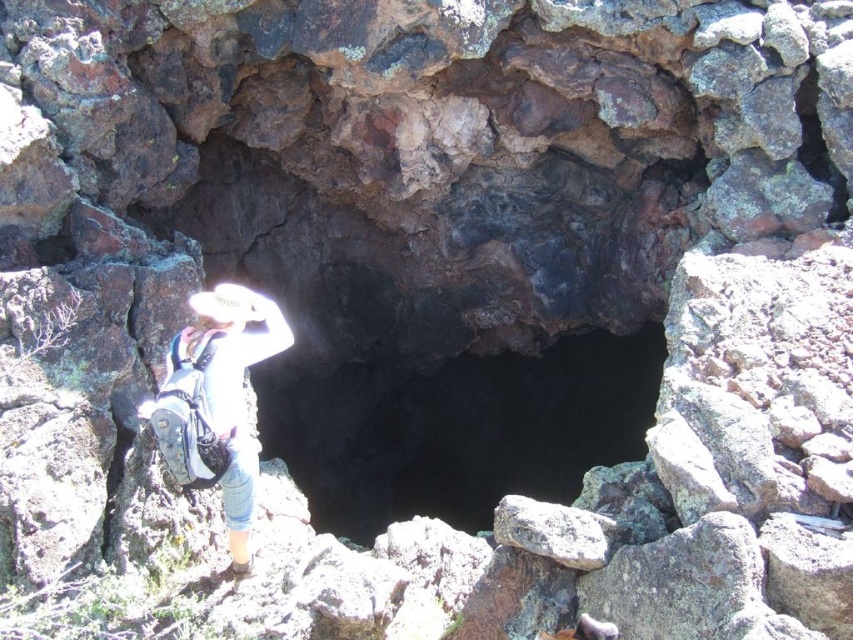
Question: Can you confirm if black rock hole at center is thinner than white fabric hat at upper center?

Choices:
 (A) no
 (B) yes

Answer: (A)

Question: Is black rock hole at center below white fabric hat at upper center?

Choices:
 (A) no
 (B) yes

Answer: (B)

Question: Which object is farther from the camera taking this photo?

Choices:
 (A) black rock hole at center
 (B) white fabric hat at upper center

Answer: (A)

Question: Does black rock hole at center have a lesser width compared to white fabric hat at upper center?

Choices:
 (A) no
 (B) yes

Answer: (A)

Question: Which object appears farthest from the camera in this image?

Choices:
 (A) black rock hole at center
 (B) white fabric hat at upper center

Answer: (A)